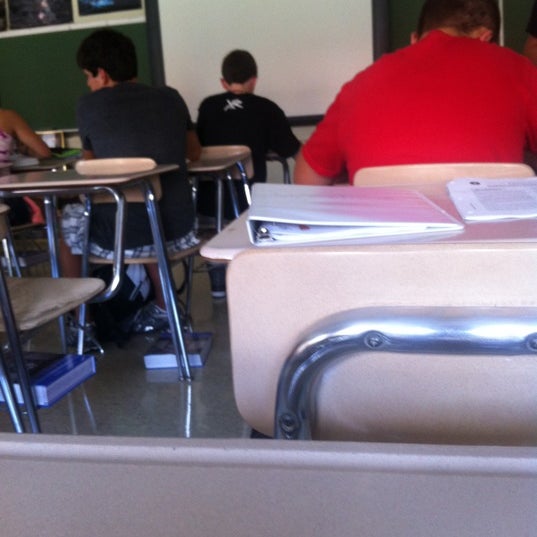
This screenshot has height=537, width=537. I want to click on desk behind student in red shirt, so [x=487, y=228].